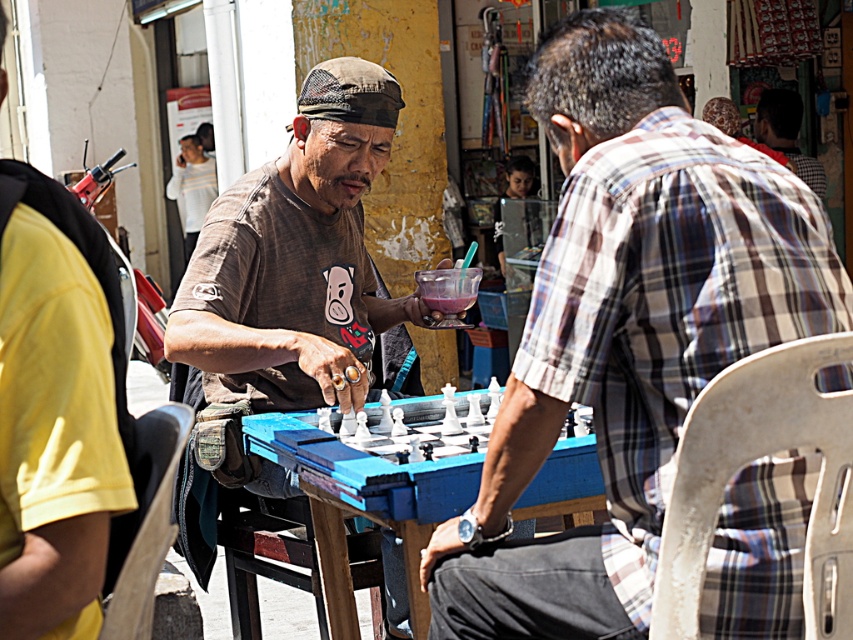
Question: Which point is closer to the camera?

Choices:
 (A) (660, 346)
 (B) (293, 442)
 (C) (361, 378)

Answer: (A)

Question: Which point is closer to the camera?

Choices:
 (A) plaid shirt at upper right
 (B) blue plastic table at center
 (C) plaid fabric shirt at center
 (D) brown cotton shirt at center

Answer: (C)

Question: Does brown cotton shirt at center have a smaller size compared to yellow fabric shirt at left?

Choices:
 (A) yes
 (B) no

Answer: (B)

Question: Among these objects, which one is nearest to the camera?

Choices:
 (A) blue plastic table at center
 (B) plaid shirt at upper right
 (C) white plastic chess set at center

Answer: (A)

Question: Can you confirm if white plastic chess set at center is wider than plaid shirt at upper right?

Choices:
 (A) no
 (B) yes

Answer: (B)

Question: Does brown cotton shirt at center appear on the left side of blue plastic table at center?

Choices:
 (A) no
 (B) yes

Answer: (B)